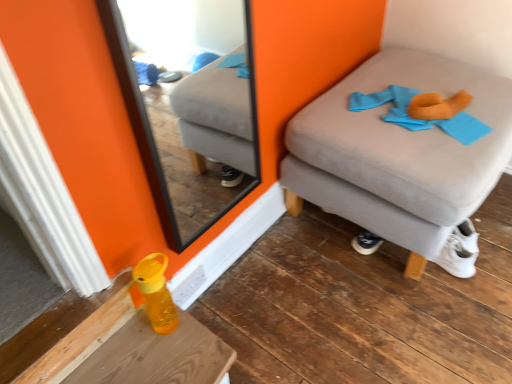
You are a GUI agent. You are given a task and a screenshot of the screen. Output one action in this format:
    pyautogui.click(x=<x>, y=<y>)
    Task: Click on the vacant space situated above wooden table at lower left (from a real-world perspective)
    This screenshot has width=512, height=384.
    Given the screenshot: What is the action you would take?
    pyautogui.click(x=164, y=356)